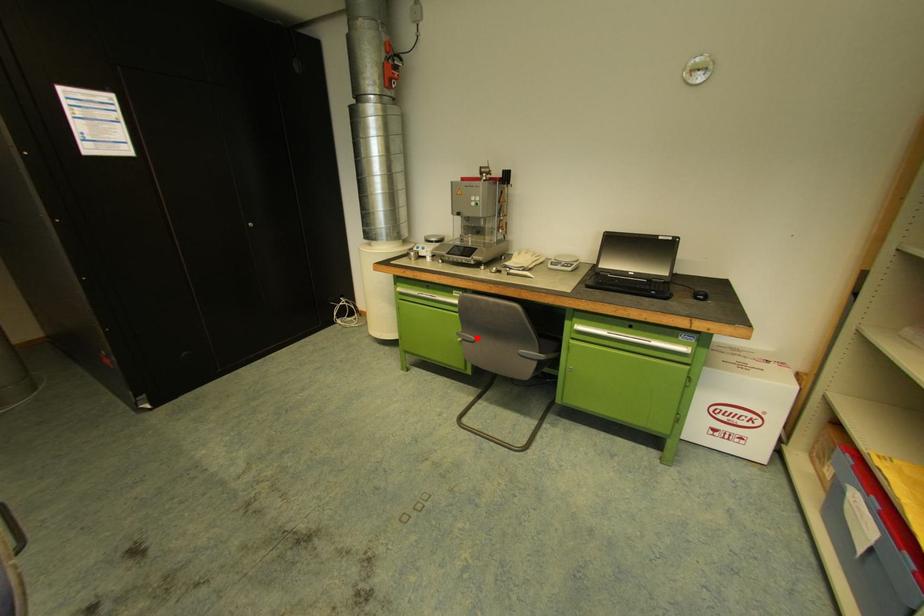
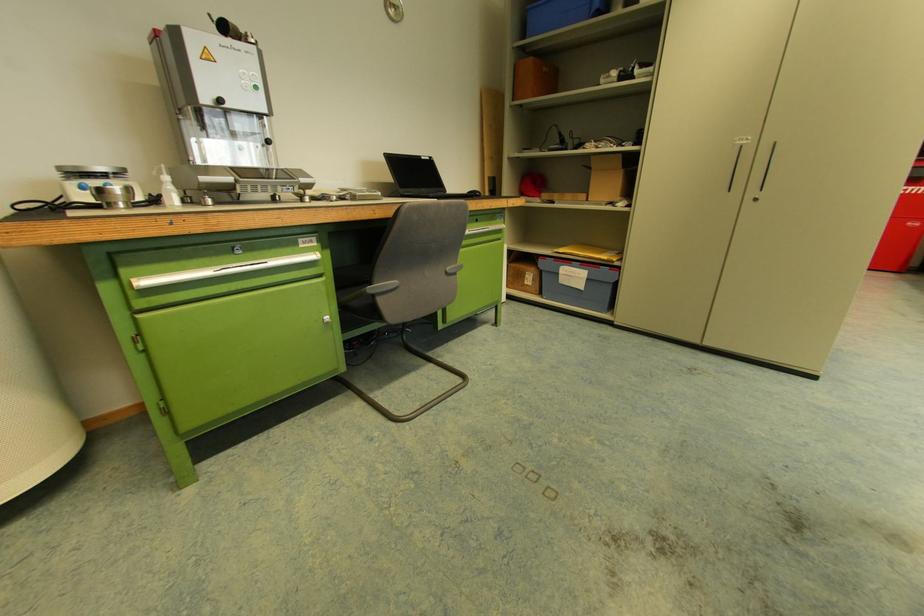
Find the pixel in the second image that matches the highlighted location in the first image.

(399, 282)